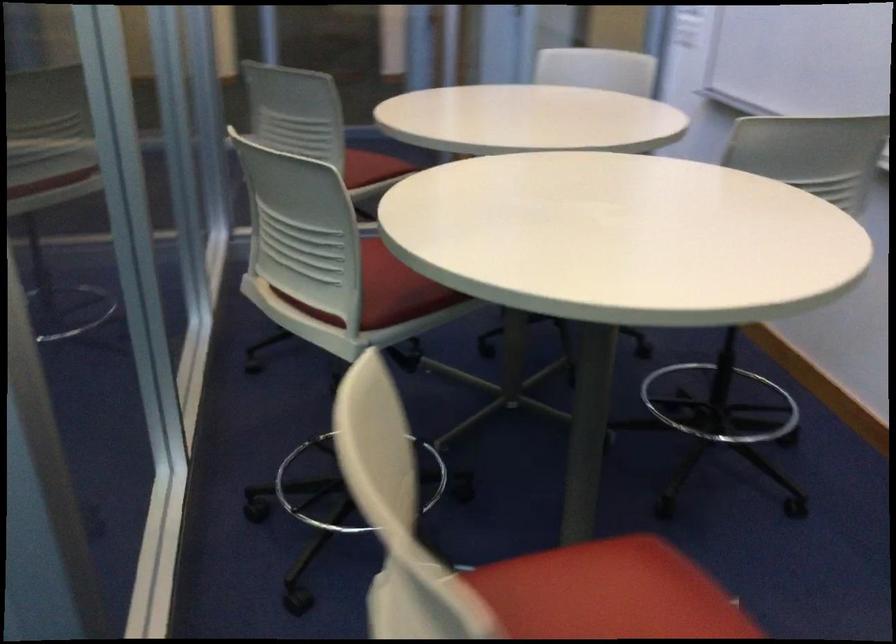
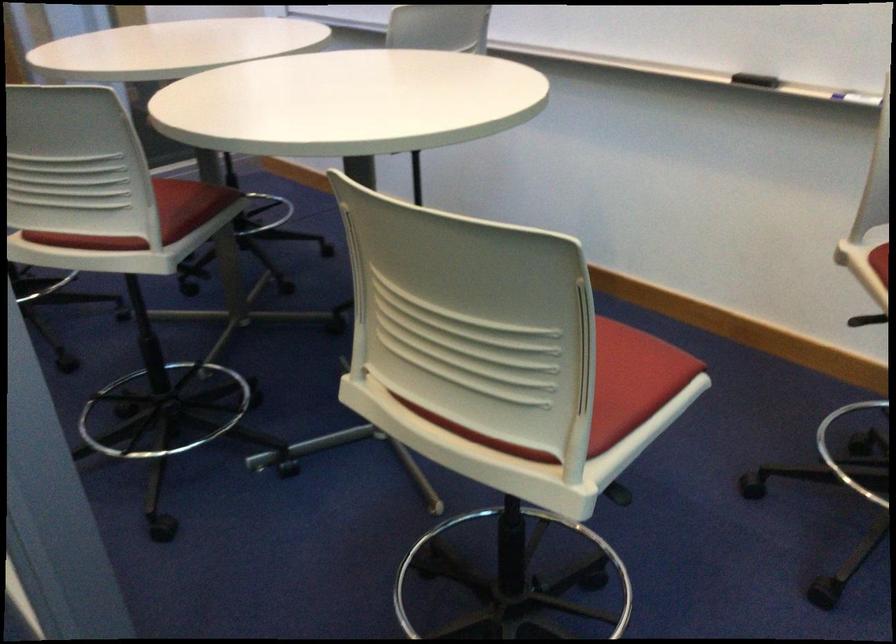
In the second image, find the point that corresponds to pixel 411 292 in the first image.

(187, 205)